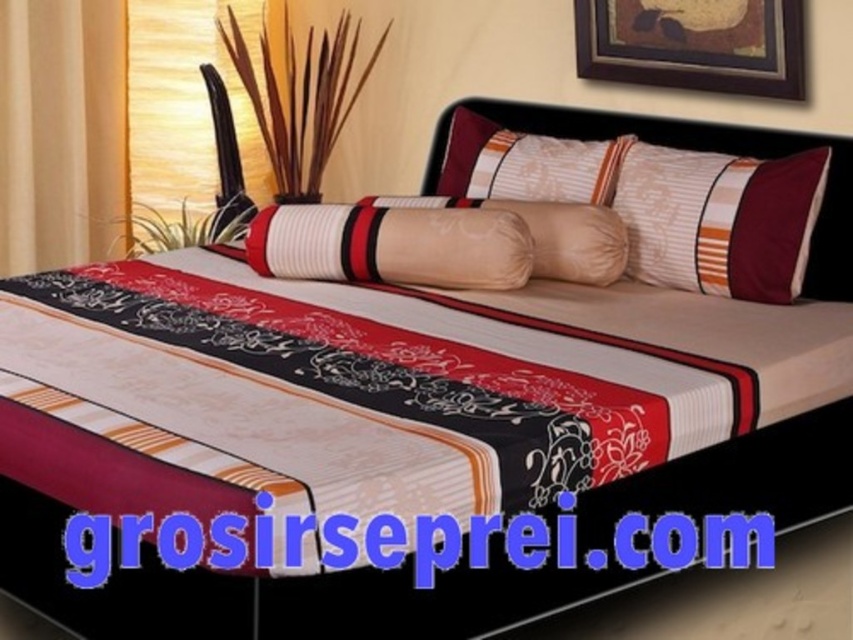
You are trying to decide where to place a new photo frame. You see the silky fabric headboard at center and the striped fabric pillow at center. Which object is taller and would be a better option for placing the frame above it?

The silky fabric headboard at center is much taller than the striped fabric pillow at center, so placing the frame above the silky fabric headboard at center would be more stable and visually balanced.

You are arranging flowers on a bed and need to place a vase between the matte white pillow at center and the beige fabric pillow at center. According to the scene, which pillow should the vase be placed in front of?

The vase should be placed in front of the beige fabric pillow at center because the matte white pillow at center is located below it, meaning the beige fabric pillow is above and closer to the viewer.

You are standing at the foot of the bed and want to reach the striped fabric pillow at upper right. The bed is 2 meters long. Can you step over the bed to reach the pillow without climbing onto it?

The distance between you and the striped fabric pillow at upper right is 3.33 meters. Since the bed is only 2 meters long, stepping over it would require covering the remaining 1.33 meters on the other side, so yes, you can step over the bed to reach the pillow without climbing onto it.